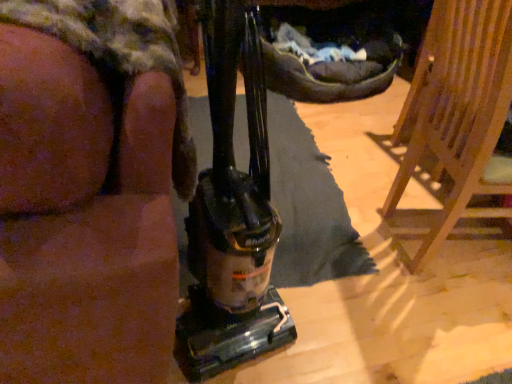
Question: From a real-world perspective, does brown fabric couch at left sit lower than wooden chair at right?

Choices:
 (A) no
 (B) yes

Answer: (A)

Question: Is brown fabric couch at left to the left of wooden chair at right from the viewer's perspective?

Choices:
 (A) yes
 (B) no

Answer: (A)

Question: From a real-world perspective, is brown fabric couch at left located higher than wooden chair at right?

Choices:
 (A) no
 (B) yes

Answer: (B)

Question: Considering the relative positions of brown fabric couch at left and wooden chair at right in the image provided, is brown fabric couch at left to the right of wooden chair at right from the viewer's perspective?

Choices:
 (A) yes
 (B) no

Answer: (B)

Question: Can you confirm if brown fabric couch at left is shorter than wooden chair at right?

Choices:
 (A) yes
 (B) no

Answer: (B)

Question: Could wooden chair at right be considered to be inside brown fabric couch at left?

Choices:
 (A) no
 (B) yes

Answer: (A)

Question: Is wooden chair at right looking in the opposite direction of brown fabric couch at left?

Choices:
 (A) no
 (B) yes

Answer: (B)

Question: Could you tell me if wooden chair at right is facing brown fabric couch at left?

Choices:
 (A) yes
 (B) no

Answer: (B)

Question: From the image's perspective, is wooden chair at right located above brown fabric couch at left?

Choices:
 (A) yes
 (B) no

Answer: (B)

Question: From a real-world perspective, is wooden chair at right over brown fabric couch at left?

Choices:
 (A) no
 (B) yes

Answer: (A)

Question: Is wooden chair at right beside brown fabric couch at left?

Choices:
 (A) no
 (B) yes

Answer: (A)

Question: Is wooden chair at right in front of brown fabric couch at left?

Choices:
 (A) yes
 (B) no

Answer: (B)

Question: Looking at their shapes, would you say brown fabric couch at left is wider or thinner than wooden chair at right?

Choices:
 (A) thin
 (B) wide

Answer: (B)